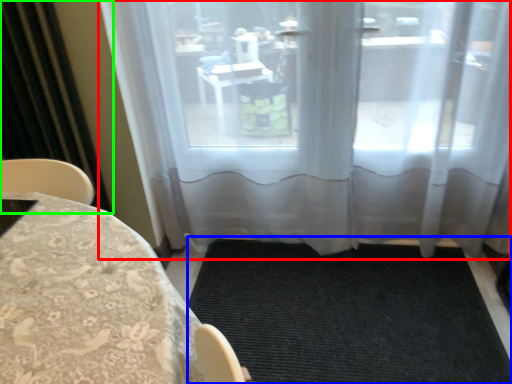
Question: Estimate the real-world distances between objects in this image. Which object is closer to window (highlighted by a red box), doormat (highlighted by a blue box) or curtain (highlighted by a green box)?

Choices:
 (A) doormat
 (B) curtain

Answer: (A)